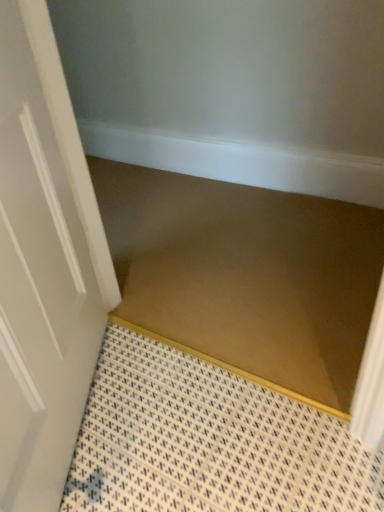
Question: Is brown matte stair at center inside the boundaries of white glossy door at left, or outside?

Choices:
 (A) inside
 (B) outside

Answer: (B)

Question: In the image, is brown matte stair at center on the left side or the right side of white glossy door at left?

Choices:
 (A) left
 (B) right

Answer: (B)

Question: Is point (104, 206) closer or farther from the camera than point (41, 326)?

Choices:
 (A) closer
 (B) farther

Answer: (B)

Question: From a real-world perspective, is white glossy door at left above or below brown matte stair at center?

Choices:
 (A) below
 (B) above

Answer: (B)

Question: Considering the positions of point (51, 106) and point (284, 262), is point (51, 106) closer or farther from the camera than point (284, 262)?

Choices:
 (A) closer
 (B) farther

Answer: (A)

Question: Would you say white glossy door at left is inside or outside brown matte stair at center?

Choices:
 (A) outside
 (B) inside

Answer: (A)

Question: From the image's perspective, is white glossy door at left positioned above or below brown matte stair at center?

Choices:
 (A) above
 (B) below

Answer: (B)